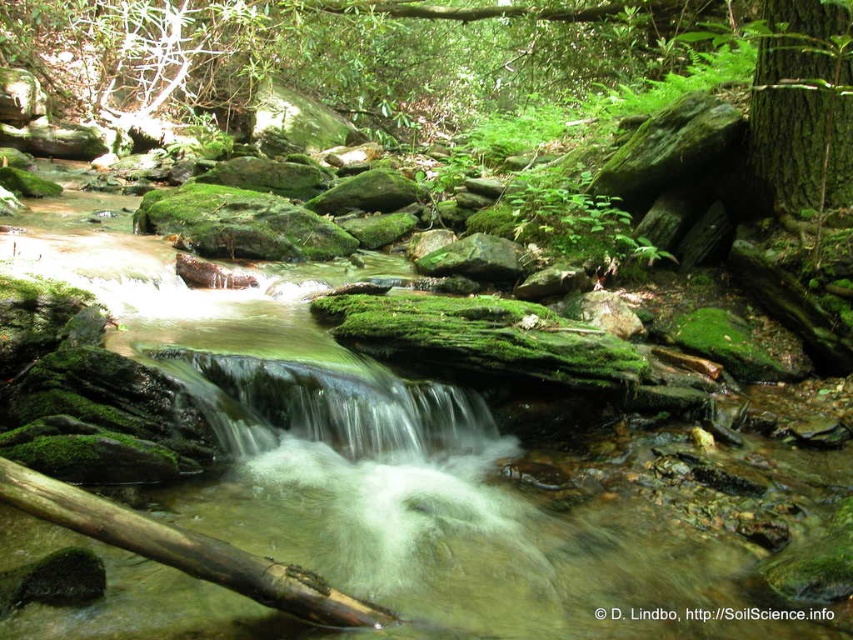
Question: Which point is closer to the camera?

Choices:
 (A) green rough bark tree at upper right
 (B) brown rough log at lower center

Answer: (B)

Question: Does green rough bark tree at upper right have a lesser width compared to brown rough log at lower center?

Choices:
 (A) yes
 (B) no

Answer: (B)

Question: Which of the following is the closest to the observer?

Choices:
 (A) green rough bark tree at upper right
 (B) brown rough log at lower center

Answer: (B)

Question: Does green rough bark tree at upper right lie behind brown rough log at lower center?

Choices:
 (A) yes
 (B) no

Answer: (A)

Question: Does green rough bark tree at upper right appear under brown rough log at lower center?

Choices:
 (A) no
 (B) yes

Answer: (A)